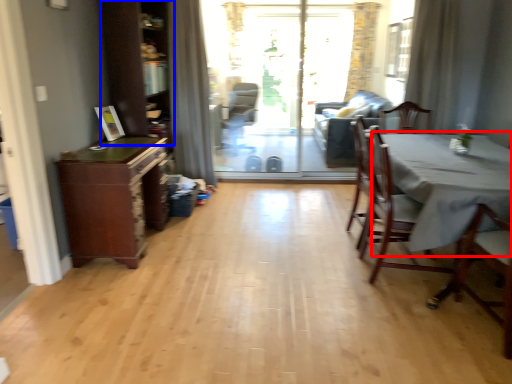
Question: Which of the following is the farthest to the observer, table (highlighted by a red box) or dresser (highlighted by a blue box)?

Choices:
 (A) table
 (B) dresser

Answer: (B)